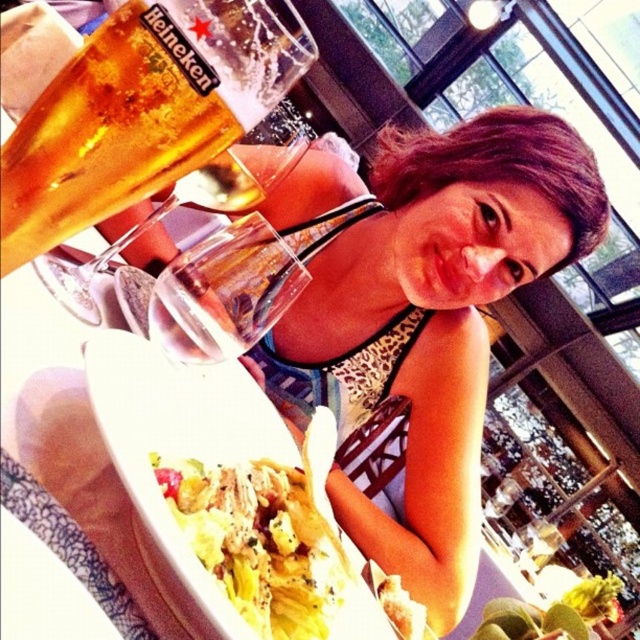
Is yellow crisp lettuce at lower center behind clear glass wine glass at upper left?

No, yellow crisp lettuce at lower center is in front of clear glass wine glass at upper left.

Does yellow crisp lettuce at lower center have a lesser width compared to clear glass wine glass at upper left?

Yes, yellow crisp lettuce at lower center is thinner than clear glass wine glass at upper left.

Identify the location of yellow crisp lettuce at lower center. click(260, 541).

This screenshot has height=640, width=640. Find the location of `yellow crisp lettuce at lower center`. yellow crisp lettuce at lower center is located at coordinates (260, 541).

Is golden amber liquid at upper left to the left of yellow crisp lettuce at lower center from the viewer's perspective?

Yes, golden amber liquid at upper left is to the left of yellow crisp lettuce at lower center.

Consider the image. Which is below, golden amber liquid at upper left or yellow crisp lettuce at lower center?

yellow crisp lettuce at lower center

What do you see at coordinates (141, 112) in the screenshot?
I see `golden amber liquid at upper left` at bounding box center [141, 112].

Find the location of `golden amber liquid at upper left`. golden amber liquid at upper left is located at coordinates (x=141, y=112).

Between yellow crisp lettuce at lower center and leopard print bikini top at center, which one appears on the left side from the viewer's perspective?

Positioned to the left is yellow crisp lettuce at lower center.

Can you confirm if yellow crisp lettuce at lower center is shorter than leopard print bikini top at center?

Yes.

Which is behind, point (202, 509) or point (264, 388)?

The point (264, 388) is behind.

The height and width of the screenshot is (640, 640). What are the coordinates of `yellow crisp lettuce at lower center` in the screenshot? It's located at (260, 541).